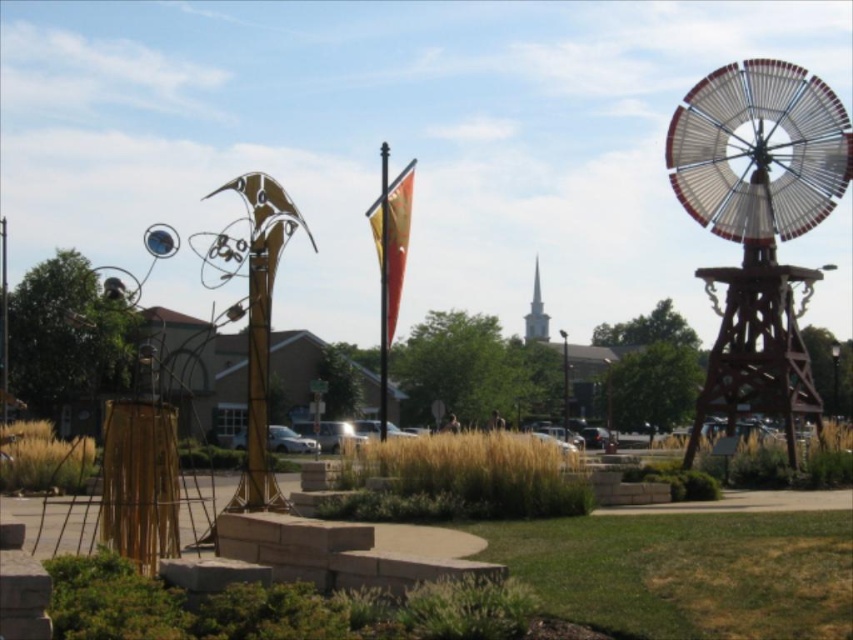
You are a park visitor who wants to take a photo of both the wooden windmill at right and the metallic flagpole at center in the same frame. Given that your camera has a maximum focal length allowing it to capture objects up to 100 feet apart, will you be able to include both in a single photo?

The wooden windmill at right is 126.76 feet away from the metallic flagpole at center, which exceeds the camera maximum focal length of 100 feet. Therefore, you cannot capture both in a single photo.

Consider the image. You are an architect designing a new public space and want to place a bench between the metallic flagpole at center and the white steeple at center. Which object should the bench be closer to if you want to ensure it doesn

The bench should be closer to the white steeple at center because the metallic flagpole at center is wider than the white steeple at center, so placing the bench closer to the narrower object would provide more balanced spacing between the two structures.

You are standing at the base of the metallic flagpole at center. You want to see the sculpture and the windmill. Which one is closer to you?

The sculpture is closer to you because it is in the foreground, while the windmill is to the right. Since the metallic flagpole at center is 115.49 meters away from the viewer, the sculpture being in the foreground would be nearer than the windmill which is placed to the right but not specified in distance. However, the given data only specifies the distance between the viewer and the flagpole, so without additional info on the sculpture and windmill distances, the answer can only state the flagpole is 115.